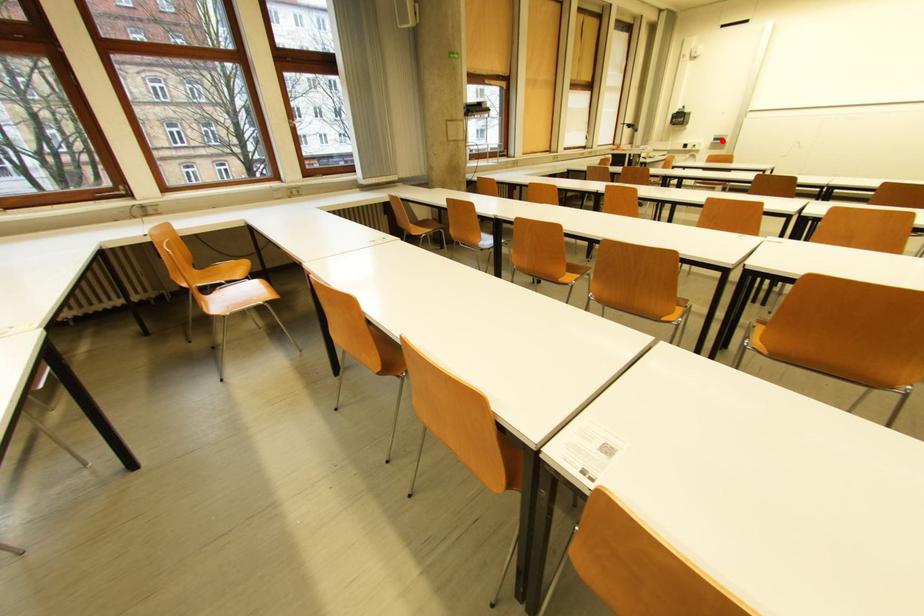
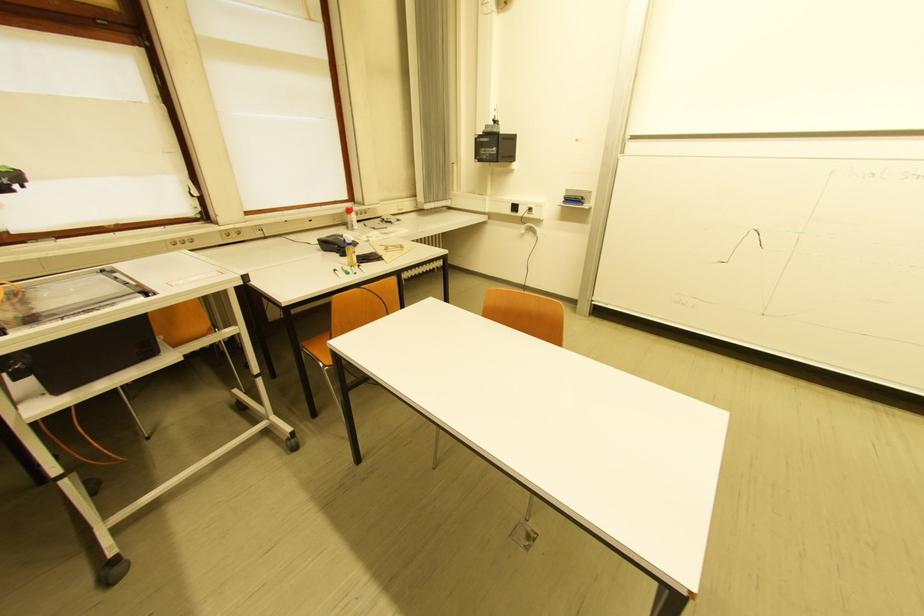
Question: A red point is marked in image1. In image2, is the corresponding 3D point closer to the camera or farther? Reply with the corresponding letter.

Choices:
 (A) The corresponding 3D point is closer.
 (B) The corresponding 3D point is farther.

Answer: (A)